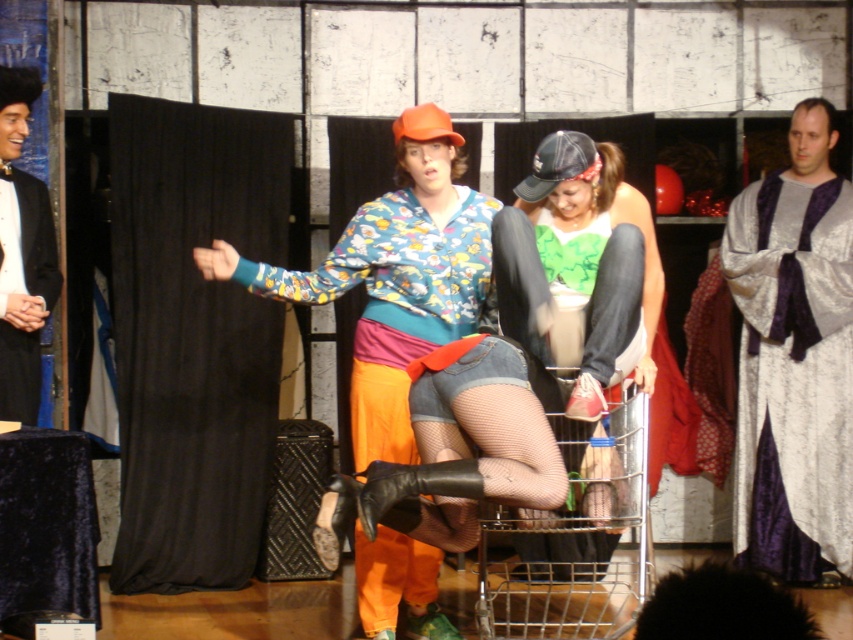
This screenshot has width=853, height=640. Describe the element at coordinates (793, 358) in the screenshot. I see `silvery metallic robe at right` at that location.

Is silvery metallic robe at right positioned in front of metallic silver shopping cart at lower center?

No, it is not.

Locate an element on the screen. silvery metallic robe at right is located at coordinates (793, 358).

Which is more to the left, silvery metallic robe at right or black satin tuxedo at left?

black satin tuxedo at left is more to the left.

How much distance is there between silvery metallic robe at right and black satin tuxedo at left?

silvery metallic robe at right and black satin tuxedo at left are 7.85 feet apart from each other.

Between point (764, 545) and point (32, 340), which one is positioned behind?

Positioned behind is point (764, 545).

Find the location of `silvery metallic robe at right`. silvery metallic robe at right is located at coordinates click(x=793, y=358).

Between point (556, 240) and point (519, 605), which one is positioned in front?

Point (556, 240)

Does green jersey at center have a lesser width compared to metallic silver shopping cart at lower center?

Correct, green jersey at center's width is less than metallic silver shopping cart at lower center's.

Is point (637, 232) closer to camera compared to point (599, 589)?

Yes, it is.

Locate an element on the screen. The image size is (853, 640). green jersey at center is located at coordinates (579, 268).